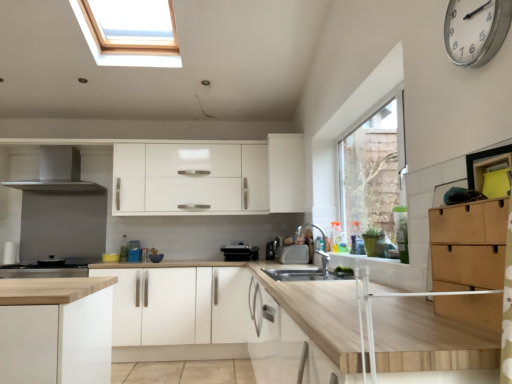
Where is `wooden at center`? The image size is (512, 384). wooden at center is located at coordinates (233, 312).

Find the location of a particular element. The width and height of the screenshot is (512, 384). light brown wood drawer at right, which is the 1th cabinetry from front to back is located at coordinates (469, 245).

Where is `satin silver toaster at center, positioned as the first appliance in front-to-back order`? The image size is (512, 384). satin silver toaster at center, positioned as the first appliance in front-to-back order is located at coordinates (292, 254).

What do you see at coordinates (274, 248) in the screenshot?
I see `satin silver toaster at center, the second appliance viewed from the front` at bounding box center [274, 248].

The image size is (512, 384). In order to click on wooden at center in this screenshot , I will do `click(233, 312)`.

Considering the positions of objects white matte cabinet at upper center, the 3th cabinetry positioned from the front, and light brown wood drawer at right, the third cabinetry in the back-to-front sequence, in the image provided, who is in front, white matte cabinet at upper center, the 3th cabinetry positioned from the front, or light brown wood drawer at right, the third cabinetry in the back-to-front sequence,?

light brown wood drawer at right, the third cabinetry in the back-to-front sequence, is in front.

Is white matte cabinet at upper center, which ranks as the 3th cabinetry in bottom-to-top order, positioned with its back to light brown wood drawer at right, which is the 1th cabinetry from front to back?

No, white matte cabinet at upper center, which ranks as the 3th cabinetry in bottom-to-top order,'s orientation is not away from light brown wood drawer at right, which is the 1th cabinetry from front to back.

Which is behind, point (280, 173) or point (470, 270)?

The point (280, 173) is behind.

In order to click on the 1st cabinetry below when counting from the white matte cabinet at upper center, the first cabinetry when ordered from back to front (from the image's perspective) in this screenshot , I will do `click(469, 245)`.

Considering the sizes of objects satin silver toaster at center, positioned as the first appliance in right-to-left order, and satin silver toaster at center, the 2th appliance when ordered from left to right, in the image provided, who is thinner, satin silver toaster at center, positioned as the first appliance in right-to-left order, or satin silver toaster at center, the 2th appliance when ordered from left to right,?

Thinner between the two is satin silver toaster at center, the 2th appliance when ordered from left to right.

Considering the points (279, 260) and (269, 257), which point is behind, point (279, 260) or point (269, 257)?

Point (269, 257)

Can you confirm if satin silver toaster at center, positioned as the first appliance in right-to-left order, is taller than satin silver toaster at center, the second appliance viewed from the front?

No.

Is satin silver toaster at center, positioned as the first appliance in right-to-left order, facing towards satin silver toaster at center, the 2th appliance when ordered from left to right?

No, satin silver toaster at center, positioned as the first appliance in right-to-left order, is not aimed at satin silver toaster at center, the 2th appliance when ordered from left to right.

From the image's perspective, relative to white metallic clock at upper right, is satin silver toaster at center, acting as the 3th appliance starting from the back, above or below?

Based on their image positions, satin silver toaster at center, acting as the 3th appliance starting from the back, is located beneath white metallic clock at upper right.

Measure the distance between satin silver toaster at center, positioned as the first appliance in right-to-left order, and white metallic clock at upper right.

satin silver toaster at center, positioned as the first appliance in right-to-left order, and white metallic clock at upper right are 8.64 feet apart from each other.

From a real-world perspective, starting from the white metallic clock at upper right, which appliance is the 3rd one below it? Please provide its 2D coordinates.

[(292, 254)]

From a real-world perspective, which object stands above the other?

white metallic clock at upper right.

Considering the points (310, 312) and (91, 190), which point is in front, point (310, 312) or point (91, 190)?

Point (310, 312)

Could satin silver metallic range hood at upper left, acting as the 2th home appliance starting from the bottom, be considered to be inside wooden at center?

No, satin silver metallic range hood at upper left, acting as the 2th home appliance starting from the bottom, is not a part of wooden at center.

From a real-world perspective, between wooden at center and satin silver metallic range hood at upper left, acting as the first home appliance starting from the top, who is vertically higher?

In real-world perspective, satin silver metallic range hood at upper left, acting as the first home appliance starting from the top, is above.

Does wooden at center turn towards satin silver metallic range hood at upper left, acting as the 2th home appliance starting from the bottom?

No, wooden at center is not aimed at satin silver metallic range hood at upper left, acting as the 2th home appliance starting from the bottom.

Is white matte cabinet at center, which is counted as the second cabinetry, starting from the front, spatially inside satin silver toaster at center, the second appliance viewed from the front, or outside of it?

white matte cabinet at center, which is counted as the second cabinetry, starting from the front, is spatially situated outside satin silver toaster at center, the second appliance viewed from the front.

Which object is more forward, white matte cabinet at center, which is the second cabinetry in back-to-front order, or satin silver toaster at center, the second appliance viewed from the front?

white matte cabinet at center, which is the second cabinetry in back-to-front order.

In the scene shown: From a real-world perspective, is white matte cabinet at center, marked as the 3th cabinetry in a right-to-left arrangement, on top of satin silver toaster at center, which is the 2th appliance in back-to-front order?

Actually, white matte cabinet at center, marked as the 3th cabinetry in a right-to-left arrangement, is physically below satin silver toaster at center, which is the 2th appliance in back-to-front order, in the real world.

Is white matte cabinet at center, marked as the 3th cabinetry in a right-to-left arrangement, turned away from satin silver toaster at center, the second appliance viewed from the front?

No, white matte cabinet at center, marked as the 3th cabinetry in a right-to-left arrangement, is not facing the opposite direction of satin silver toaster at center, the second appliance viewed from the front.

Which of these two, light brown wood drawer at right, arranged as the second cabinetry when ordered from the bottom, or satin silver toaster at center, which is the 2th appliance from right to left, is wider?

light brown wood drawer at right, arranged as the second cabinetry when ordered from the bottom, is wider.

Considering the relative positions of light brown wood drawer at right, arranged as the second cabinetry when ordered from the bottom, and satin silver toaster at center, which is the 2th appliance from right to left, in the image provided, is light brown wood drawer at right, arranged as the second cabinetry when ordered from the bottom, to the right of satin silver toaster at center, which is the 2th appliance from right to left, from the viewer's perspective?

Yes, light brown wood drawer at right, arranged as the second cabinetry when ordered from the bottom, is to the right of satin silver toaster at center, which is the 2th appliance from right to left.

Consider the image. Does light brown wood drawer at right, which is the 1th cabinetry from front to back, touch satin silver toaster at center, which is the 2th appliance in back-to-front order?

No, light brown wood drawer at right, which is the 1th cabinetry from front to back, is not beside satin silver toaster at center, which is the 2th appliance in back-to-front order.

Where is `appliance that is the 1st one when counting downward from the light brown wood drawer at right, which ranks as the 3th cabinetry in left-to-right order (from the image's perspective)`? The image size is (512, 384). appliance that is the 1st one when counting downward from the light brown wood drawer at right, which ranks as the 3th cabinetry in left-to-right order (from the image's perspective) is located at coordinates (274, 248).

From a real-world perspective, is silver metallic faucet at center positioned above or below white matte cabinet at upper center, which ranks as the 3th cabinetry in bottom-to-top order?

From a real-world perspective, silver metallic faucet at center is physically below white matte cabinet at upper center, which ranks as the 3th cabinetry in bottom-to-top order.

Considering the sizes of silver metallic faucet at center and white matte cabinet at upper center, the 1th cabinetry when ordered from top to bottom, in the image, is silver metallic faucet at center taller or shorter than white matte cabinet at upper center, the 1th cabinetry when ordered from top to bottom,?

Clearly, silver metallic faucet at center is shorter compared to white matte cabinet at upper center, the 1th cabinetry when ordered from top to bottom.

From the image's perspective, who appears lower, silver metallic faucet at center or white matte cabinet at upper center, which ranks as the 3th cabinetry in bottom-to-top order?

silver metallic faucet at center, from the image's perspective.

Starting from the silver metallic faucet at center, which cabinetry is the 1st one to the left? Please provide its 2D coordinates.

[(286, 173)]

At what (x,y) coordinates should I click in order to perform the action: click on the 2nd cabinetry behind the light brown wood drawer at right, acting as the 2th cabinetry starting from the top, starting your count from the anchor. Please return your answer as a coordinate pair (x, y). Image resolution: width=512 pixels, height=384 pixels. Looking at the image, I should click on (286, 173).

Where is `appliance that is the 1st one when counting downward from the satin silver toaster at center, which is the 2th appliance in back-to-front order (from the image's perspective)`? This screenshot has height=384, width=512. appliance that is the 1st one when counting downward from the satin silver toaster at center, which is the 2th appliance in back-to-front order (from the image's perspective) is located at coordinates (292, 254).

Considering their positions, is satin silver toaster at center, which is the 2th appliance in back-to-front order, positioned further to stainless steel stove at lower left, which is the first home appliance in bottom-to-top order, than satin silver toaster at center, which is the third appliance from left to right?

Among the two, satin silver toaster at center, which is the third appliance from left to right, is located further to stainless steel stove at lower left, which is the first home appliance in bottom-to-top order.

Considering their positions, is white matte cabinet at upper center, the 3th cabinetry positioned from the front, positioned closer to wooden at center than satin silver toaster at center, the second appliance viewed from the front?

white matte cabinet at upper center, the 3th cabinetry positioned from the front, is positioned closer to the anchor wooden at center.

Which object lies nearer to the anchor point white matte cabinet at center, which is counted as the second cabinetry, starting from the front, silver metallic faucet at center or light brown wood drawer at right, acting as the 2th cabinetry starting from the top?

silver metallic faucet at center is closer to white matte cabinet at center, which is counted as the second cabinetry, starting from the front.

Considering their positions, is light brown wood drawer at right, which is the 1th cabinetry from front to back, positioned closer to black plastic toaster at center, the third appliance positioned from the right, than white metallic clock at upper right?

light brown wood drawer at right, which is the 1th cabinetry from front to back, lies closer to black plastic toaster at center, the third appliance positioned from the right, than the other object.

Based on the photo, when comparing their distances from white metallic clock at upper right, does satin silver toaster at center, acting as the 3th appliance starting from the back, or white matte cabinet at center, placed as the 1th cabinetry when sorted from bottom to top, seem further?

Based on the image, white matte cabinet at center, placed as the 1th cabinetry when sorted from bottom to top, appears to be further to white metallic clock at upper right.

When comparing their distances from satin silver toaster at center, positioned as the first appliance in right-to-left order, does satin silver metallic range hood at upper left, acting as the 2th home appliance starting from the bottom, or wooden at center seem further?

satin silver metallic range hood at upper left, acting as the 2th home appliance starting from the bottom, lies further to satin silver toaster at center, positioned as the first appliance in right-to-left order, than the other object.

Looking at the image, which one is located closer to white matte cabinet at upper center, which ranks as the 3th cabinetry in bottom-to-top order, black plastic toaster at center, which appears as the 1th appliance when viewed from the back, or satin silver toaster at center, acting as the 3th appliance starting from the back?

Among the two, satin silver toaster at center, acting as the 3th appliance starting from the back, is located nearer to white matte cabinet at upper center, which ranks as the 3th cabinetry in bottom-to-top order.

Considering their positions, is black plastic toaster at center, the third appliance positioned from the right, positioned closer to satin silver metallic range hood at upper left, acting as the first home appliance starting from the top, than stainless steel stove at lower left, which is counted as the 2th home appliance, starting from the top?

stainless steel stove at lower left, which is counted as the 2th home appliance, starting from the top, is positioned closer to the anchor satin silver metallic range hood at upper left, acting as the first home appliance starting from the top.

Locate an element on the screen. clock between wooden at center and silver metallic faucet at center from front to back is located at coordinates (475, 30).

Locate an element on the screen. Image resolution: width=512 pixels, height=384 pixels. faucet between light brown wood drawer at right, arranged as the second cabinetry when ordered from the bottom, and black plastic toaster at center, which is the 1th appliance from left to right, from front to back is located at coordinates (318, 250).

The image size is (512, 384). Find the location of `appliance located between satin silver toaster at center, positioned as the first appliance in front-to-back order, and black plastic toaster at center, which appears as the 1th appliance when viewed from the back, in the depth direction`. appliance located between satin silver toaster at center, positioned as the first appliance in front-to-back order, and black plastic toaster at center, which appears as the 1th appliance when viewed from the back, in the depth direction is located at coordinates (274, 248).

Image resolution: width=512 pixels, height=384 pixels. What are the coordinates of `appliance positioned between white metallic clock at upper right and white matte cabinet at center, placed as the 1th cabinetry when sorted from bottom to top, from near to far` in the screenshot? It's located at (292, 254).